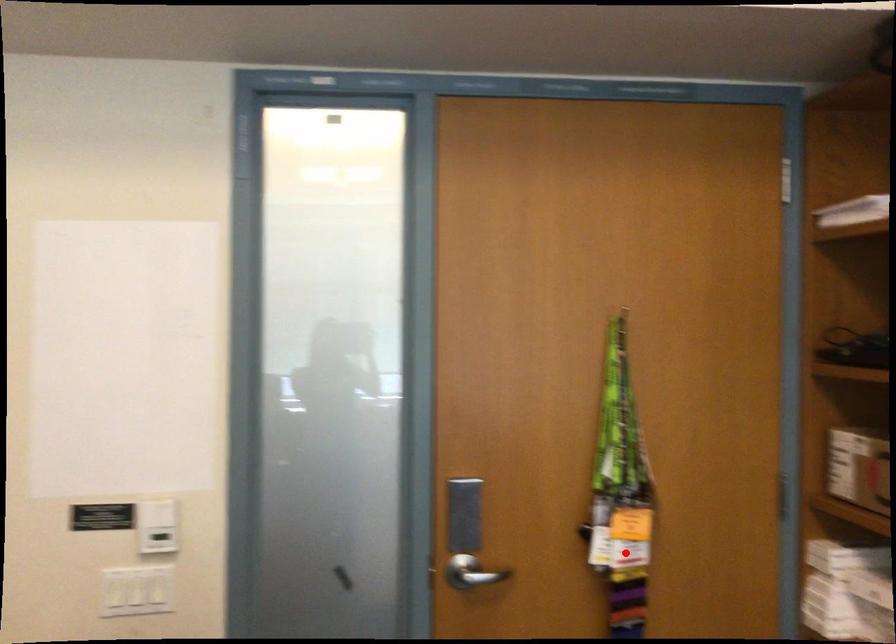
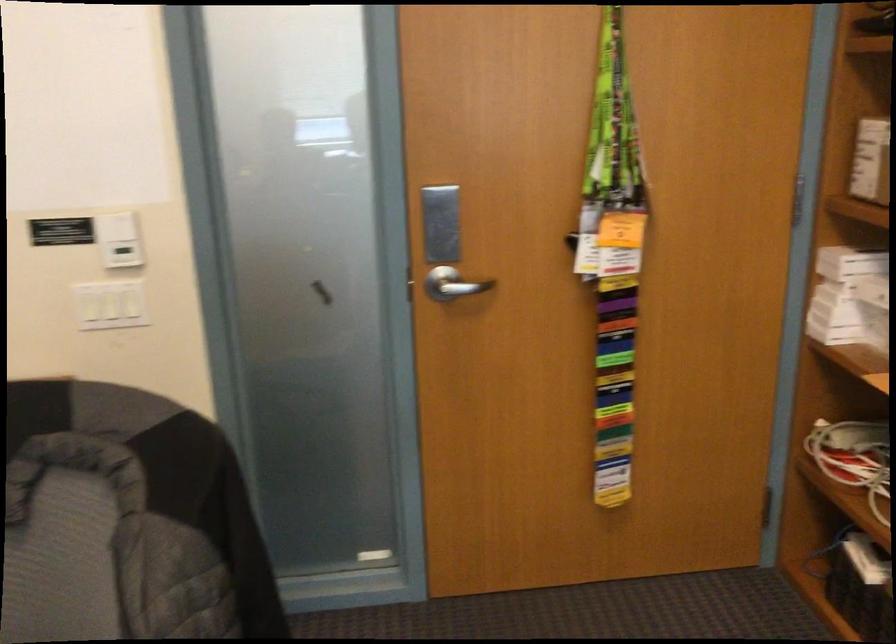
The point at the highlighted location is marked in the first image. Where is the corresponding point in the second image?

(613, 259)